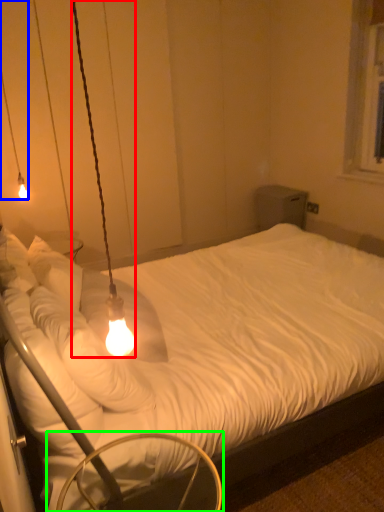
Question: Which object is the closest to the lamp (highlighted by a red box)? Choose among these: lamp (highlighted by a blue box) or swivel chair (highlighted by a green box).

Choices:
 (A) lamp
 (B) swivel chair

Answer: (B)